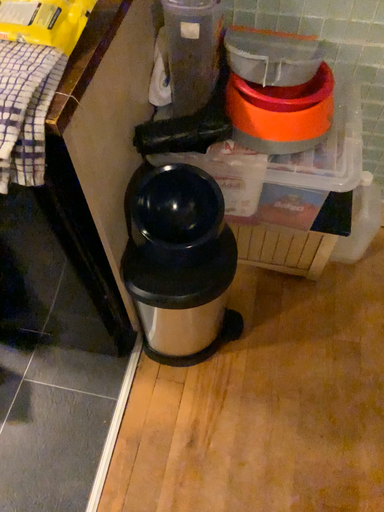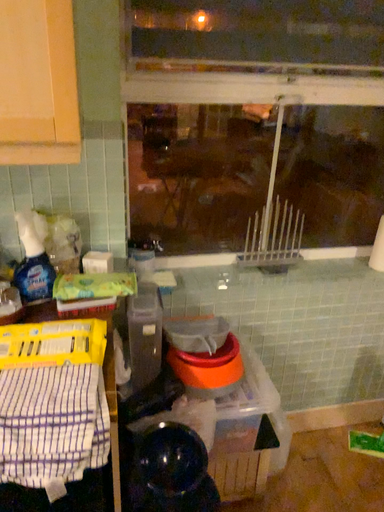
Question: How did the camera likely rotate when shooting the video?

Choices:
 (A) rotated left
 (B) rotated right

Answer: (B)